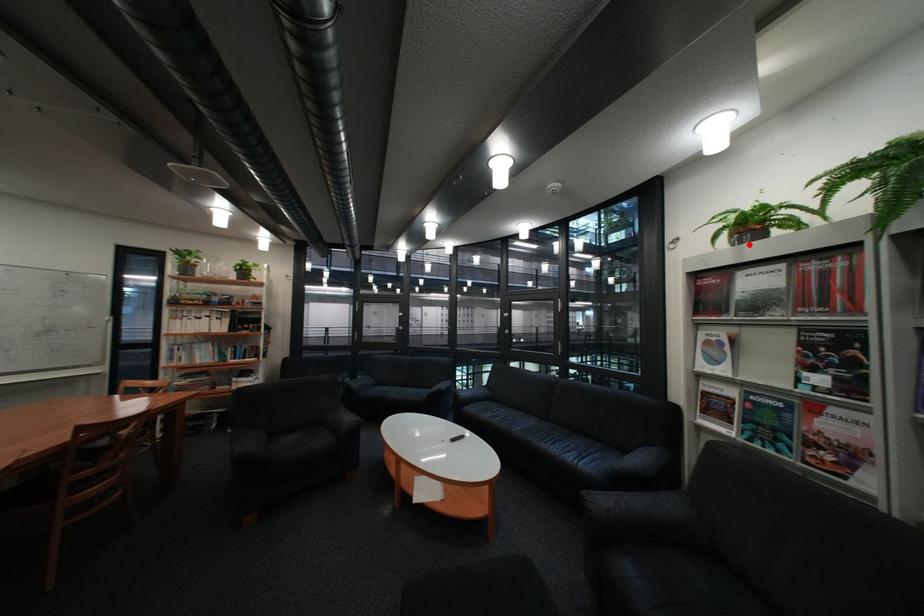
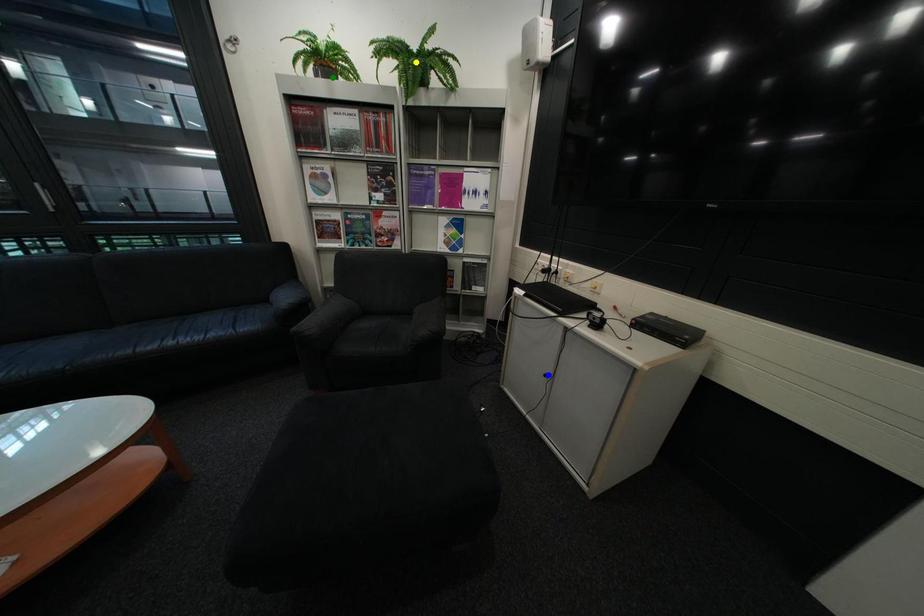
Question: I am providing you with two images of the same scene from different viewpoints. A red point is marked on the first image. You are given multiple points on the second image. Which point in image 2 represents the same 3d spot as the red point in image 1?

Choices:
 (A) yellow point
 (B) blue point
 (C) green point

Answer: (C)